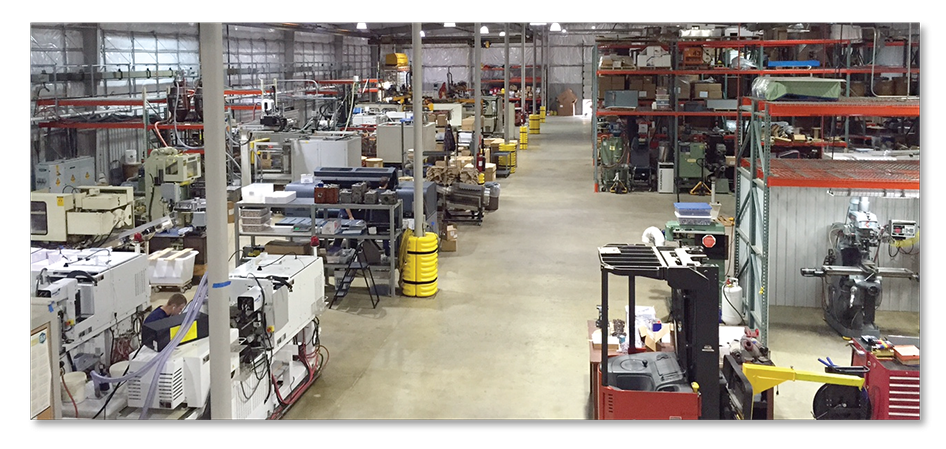
The image size is (946, 449). Find the location of `columns`. columns is located at coordinates (211, 73), (412, 87), (473, 84), (503, 76), (522, 64), (538, 62).